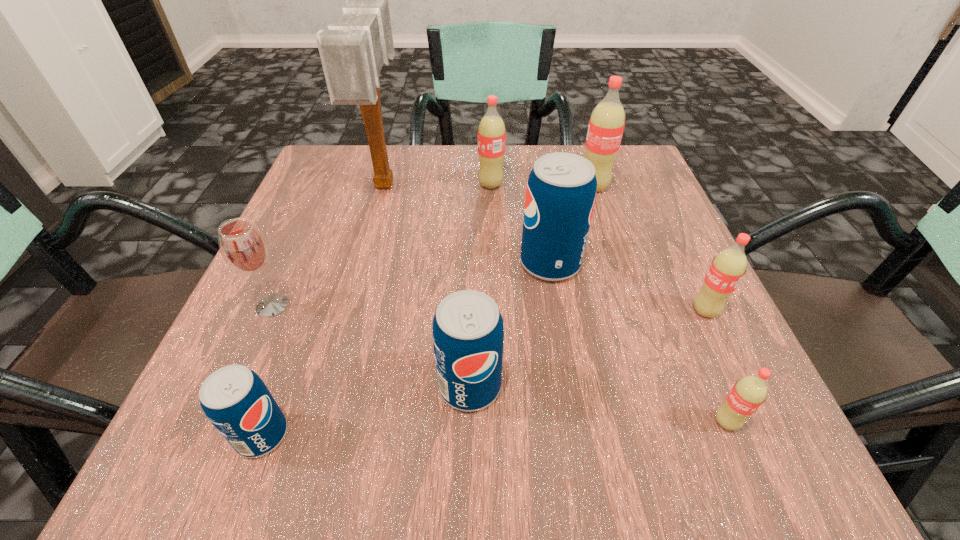
Locate an element on the screen. This screenshot has width=960, height=540. free space located 0.120m on the back of the second smallest blue pop is located at coordinates (471, 299).

Identify the location of free space located on the front of the second nearest red soda. (746, 396).

At what (x,y) coordinates should I click in order to perform the action: click on vacant region located on the right of the smallest blue pop. Please return your answer as a coordinate pair (x, y). The image size is (960, 540). Looking at the image, I should click on (586, 435).

Locate an element on the screen. This screenshot has width=960, height=540. vacant space located on the left of the nearest red soda is located at coordinates pyautogui.click(x=560, y=422).

You are a GUI agent. You are given a task and a screenshot of the screen. Output one action in this format:
    pyautogui.click(x=<x>, y=<y>)
    Task: Click on the mallet situated at the far edge
    This screenshot has height=540, width=960.
    Given the screenshot: What is the action you would take?
    pyautogui.click(x=352, y=52)

The width and height of the screenshot is (960, 540). In order to click on mallet at the left edge in this screenshot , I will do `click(352, 52)`.

Where is `wineglass situated at the left edge`? wineglass situated at the left edge is located at coordinates (244, 248).

At what (x,y) coordinates should I click in order to perform the action: click on pop that is at the left edge. Please return your answer as a coordinate pair (x, y). This screenshot has width=960, height=540. Looking at the image, I should click on (235, 400).

The image size is (960, 540). I want to click on object at the far left corner, so click(352, 52).

Locate an element on the screen. Image resolution: width=960 pixels, height=540 pixels. object positioned at the near left corner is located at coordinates (235, 400).